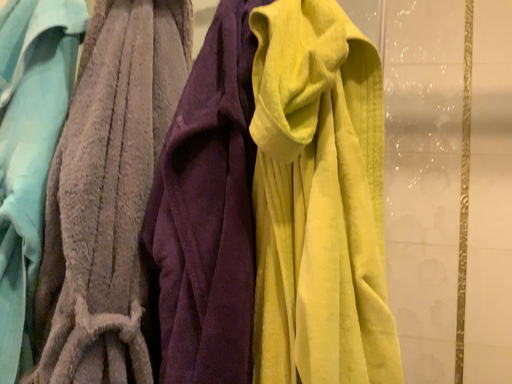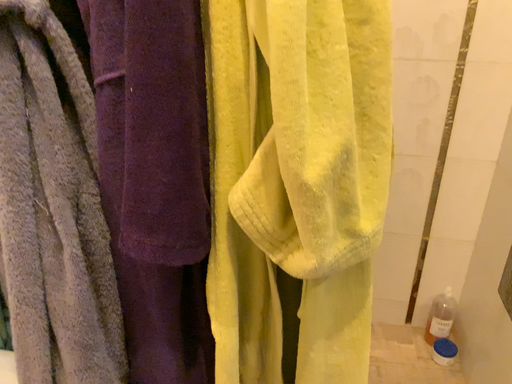
Question: Which way did the camera rotate in the video?

Choices:
 (A) rotated upward
 (B) rotated downward

Answer: (B)